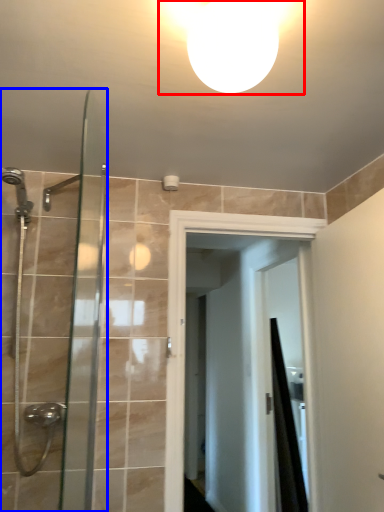
Question: Which object is further to the camera taking this photo, light fixture (highlighted by a red box) or shower door (highlighted by a blue box)?

Choices:
 (A) light fixture
 (B) shower door

Answer: (B)